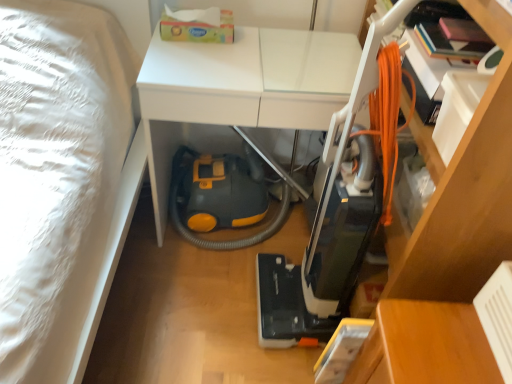
This screenshot has width=512, height=384. Find the location of `free space between orange corded vacuum cleaner at center and white glossy table at center, placed as the 1th table when sorted from top to bottom`. free space between orange corded vacuum cleaner at center and white glossy table at center, placed as the 1th table when sorted from top to bottom is located at coordinates (222, 290).